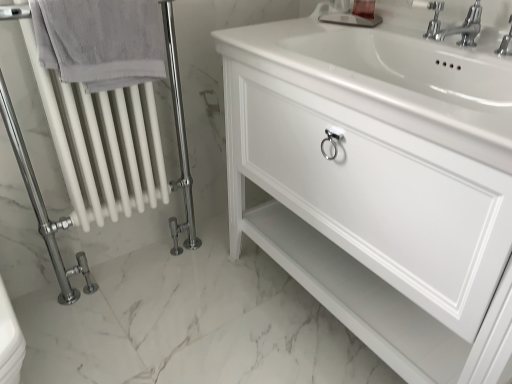
Question: In the image, is polished chrome faucet at upper right on the left side or the right side of white glossy radiator at left?

Choices:
 (A) left
 (B) right

Answer: (B)

Question: Based on their sizes in the image, would you say polished chrome faucet at upper right is bigger or smaller than white glossy radiator at left?

Choices:
 (A) small
 (B) big

Answer: (A)

Question: Estimate the real-world distances between objects in this image. Which object is closer to the gray cotton towel at left?

Choices:
 (A) white glossy cabinet at center
 (B) polished chrome faucet at upper right
 (C) clear plastic soap at upper center
 (D) white glossy radiator at left
 (E) chrome metallic faucet at upper right

Answer: (D)

Question: Which object is the closest to the chrome metallic faucet at upper right?

Choices:
 (A) white glossy radiator at left
 (B) clear plastic soap at upper center
 (C) white glossy cabinet at center
 (D) polished chrome faucet at upper right
 (E) gray cotton towel at left

Answer: (D)